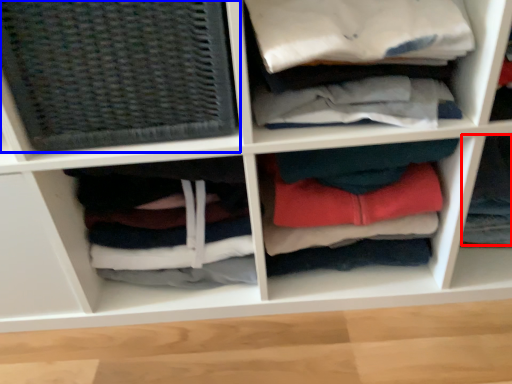
Question: Among these objects, which one is farthest to the camera, clothing (highlighted by a red box) or basket (highlighted by a blue box)?

Choices:
 (A) clothing
 (B) basket

Answer: (A)